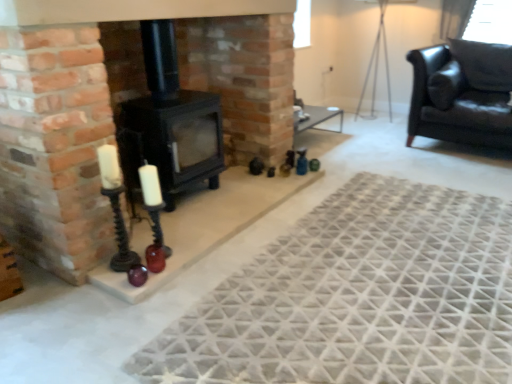
The width and height of the screenshot is (512, 384). Find the location of `vacant area on the back side of black wrought iron candle holder at left, marked as the 2th candle holder in a right-to-left arrangement`. vacant area on the back side of black wrought iron candle holder at left, marked as the 2th candle holder in a right-to-left arrangement is located at coordinates (142, 244).